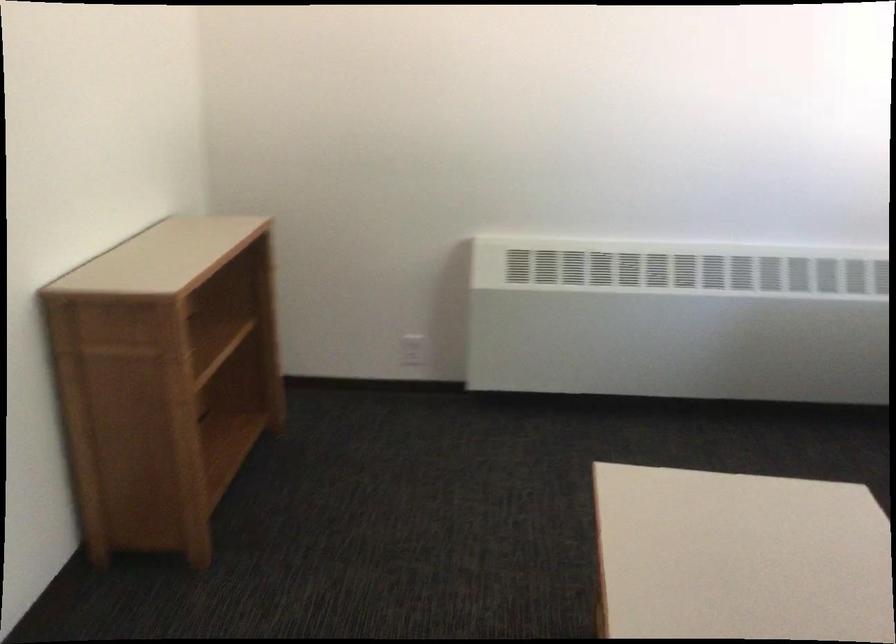
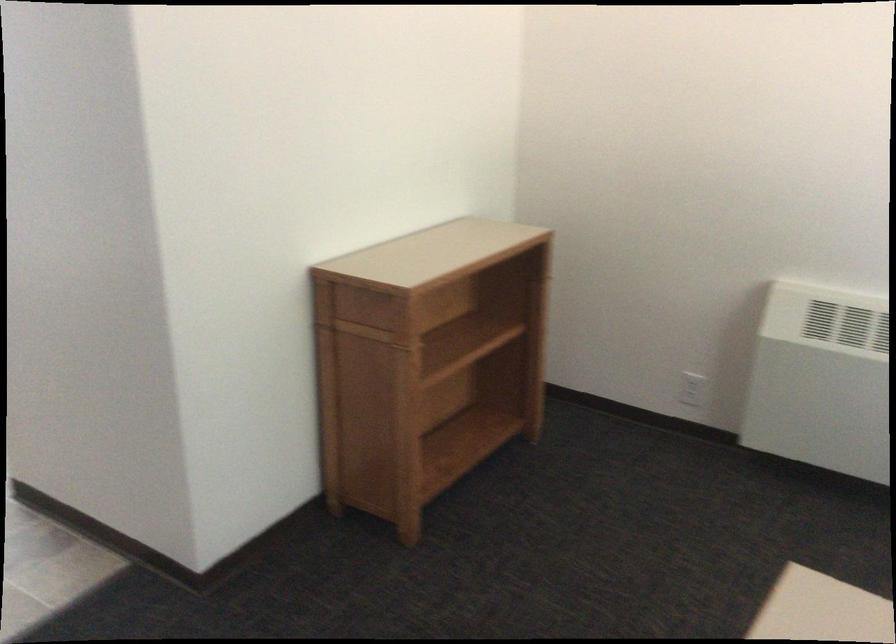
The point at (418, 352) is marked in the first image. Where is the corresponding point in the second image?

(692, 389)